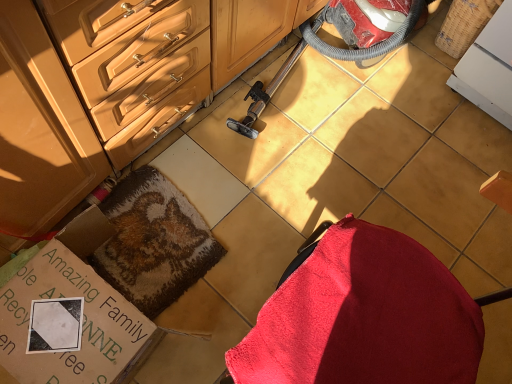
The height and width of the screenshot is (384, 512). What are the coordinates of `vacant area that lies between velvet red swivel chair at center and fluffy brown rug at center` in the screenshot? It's located at (232, 261).